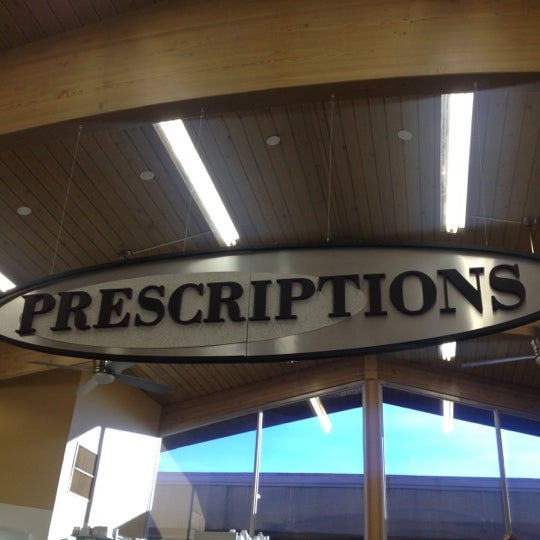
Where is `ceiling lights`? ceiling lights is located at coordinates (26, 214), (147, 180).